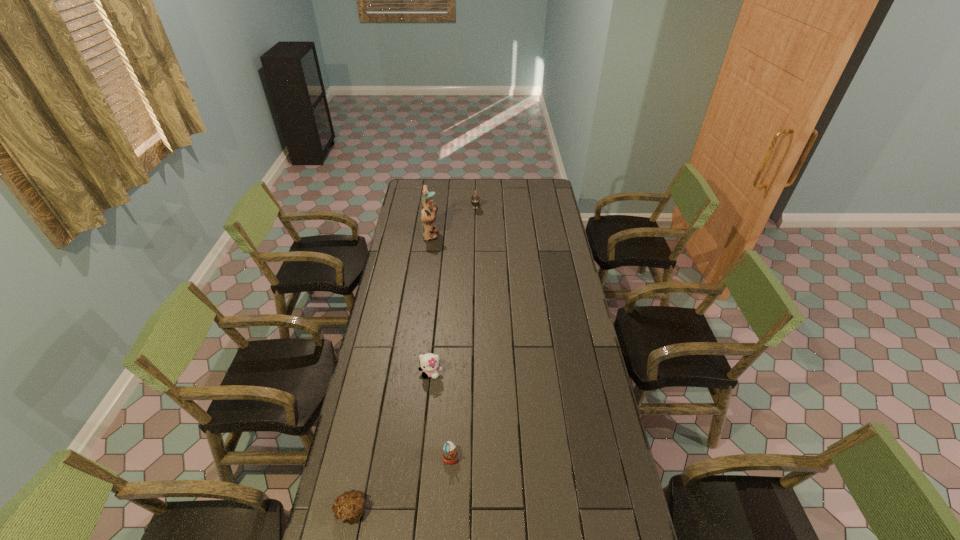
The height and width of the screenshot is (540, 960). I want to click on free spot between the fourth farthest object and the farther kitten, so click(463, 331).

What are the coordinates of `object identified as the third closest to the leftmost object` in the screenshot? It's located at (428, 209).

Locate which object ranks in proximity to the shortest object. Please provide its 2D coordinates. Your answer should be formatted as a tuple, i.e. [(x, y)], where the tuple contains the x and y coordinates of a point satisfying the conditions above.

[(450, 454)]

Image resolution: width=960 pixels, height=540 pixels. I want to click on blank area in the image that satisfies the following two spatial constraints: 1. on the front-facing side of the farther kitten; 2. on the front-facing side of the figurine, so click(x=475, y=235).

I want to click on free point that satisfies the following two spatial constraints: 1. on the front-facing side of the farther kitten; 2. on the front-facing side of the fourth nearest object, so click(475, 235).